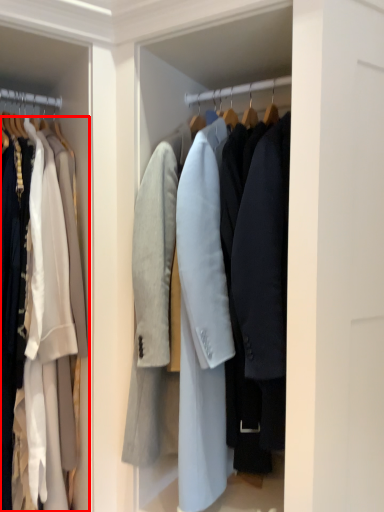
Question: From the image's perspective, where is coat (annotated by the red box) located in relation to coat in the image?

Choices:
 (A) above
 (B) below

Answer: (B)